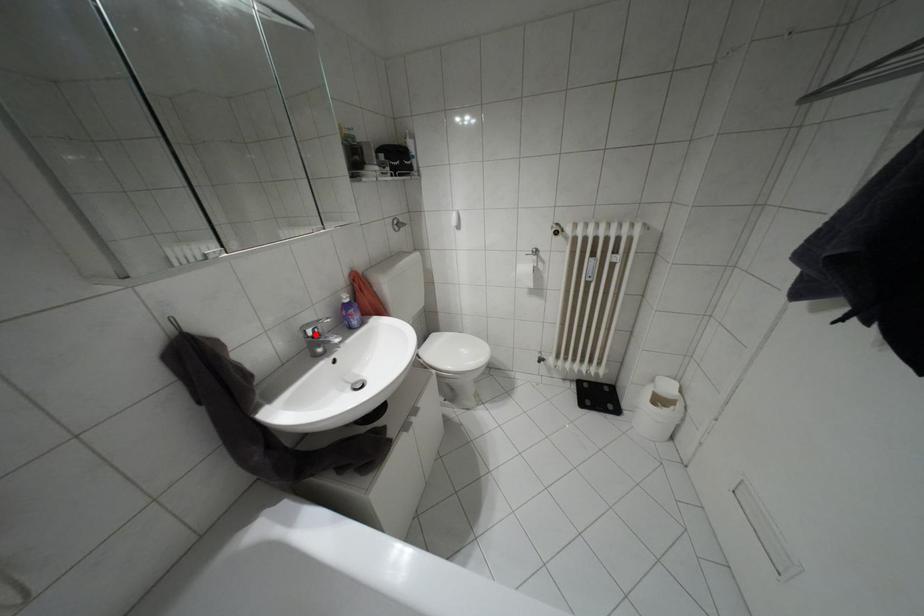
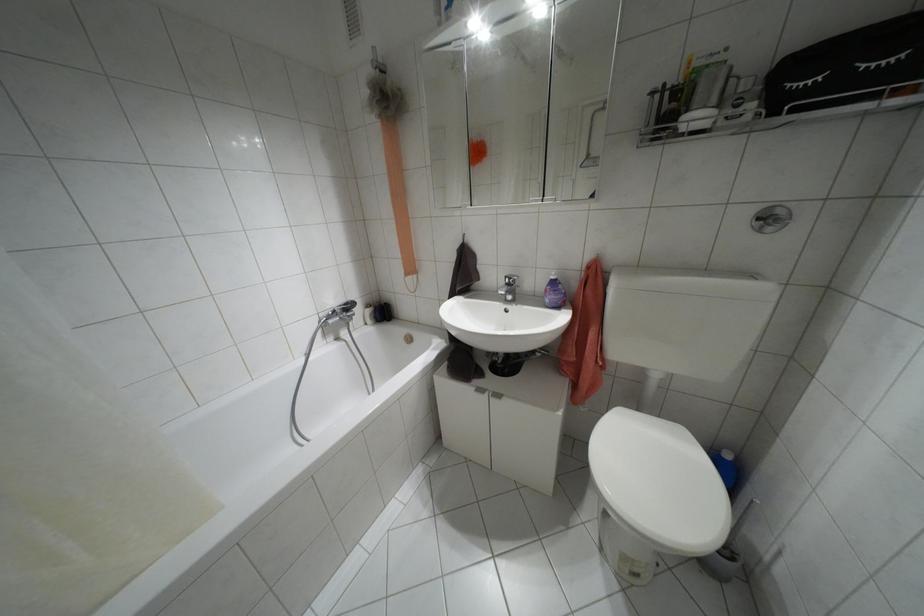
Where in the second image is the point corresponding to the highlighted location from the first image?

(507, 284)